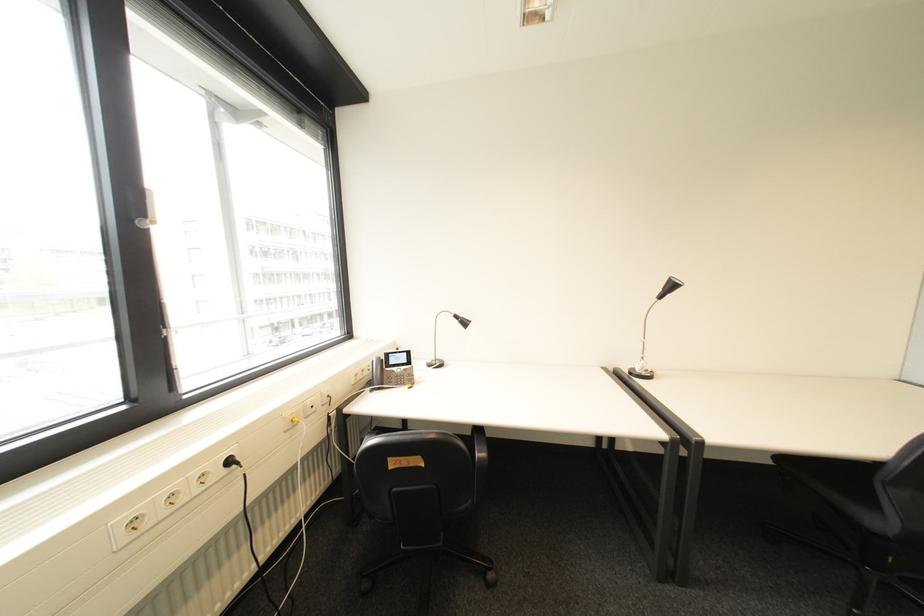
Find the location of `white window handle`. white window handle is located at coordinates (148, 216).